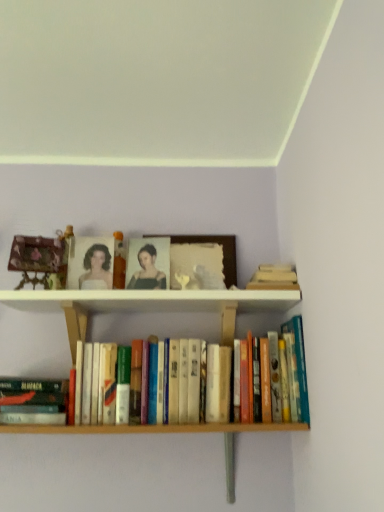
Question: In which direction should I rotate to look at hardcover books at center, which is the first book from right to left?

Choices:
 (A) left
 (B) right

Answer: (A)

Question: Is wooden picture frame at center surrounding hardcover books at center, which is the first book from right to left?

Choices:
 (A) yes
 (B) no

Answer: (B)

Question: From a real-world perspective, does wooden picture frame at center sit lower than hardcover books at center, marked as the 2th book in a left-to-right arrangement?

Choices:
 (A) no
 (B) yes

Answer: (A)

Question: From a real-world perspective, is wooden picture frame at center on hardcover books at center, which is the first book from right to left?

Choices:
 (A) no
 (B) yes

Answer: (B)

Question: Is wooden picture frame at center positioned in front of hardcover books at center, which is the first book from right to left?

Choices:
 (A) no
 (B) yes

Answer: (A)

Question: Considering the relative sizes of wooden picture frame at center and hardcover books at center, which is the first book from right to left, in the image provided, is wooden picture frame at center taller than hardcover books at center, which is the first book from right to left,?

Choices:
 (A) yes
 (B) no

Answer: (B)

Question: Considering the relative sizes of wooden picture frame at center and hardcover books at center, which is the first book from right to left, in the image provided, is wooden picture frame at center shorter than hardcover books at center, which is the first book from right to left,?

Choices:
 (A) no
 (B) yes

Answer: (B)

Question: Does wooden carved figurine at left lie in front of wooden picture frame at center?

Choices:
 (A) no
 (B) yes

Answer: (B)

Question: Can you confirm if wooden carved figurine at left is wider than wooden picture frame at center?

Choices:
 (A) no
 (B) yes

Answer: (B)

Question: Would you say wooden carved figurine at left contains wooden picture frame at center?

Choices:
 (A) yes
 (B) no

Answer: (B)

Question: From a real-world perspective, is wooden carved figurine at left positioned over wooden picture frame at center based on gravity?

Choices:
 (A) no
 (B) yes

Answer: (A)

Question: Is wooden carved figurine at left facing away from wooden picture frame at center?

Choices:
 (A) yes
 (B) no

Answer: (B)

Question: Considering the relative sizes of wooden carved figurine at left and wooden picture frame at center in the image provided, is wooden carved figurine at left bigger than wooden picture frame at center?

Choices:
 (A) no
 (B) yes

Answer: (A)

Question: Can you confirm if hardcover books at center, marked as the 2th book in a left-to-right arrangement, is shorter than hardcover book at lower left, which appears as the second book when viewed from the right?

Choices:
 (A) no
 (B) yes

Answer: (A)